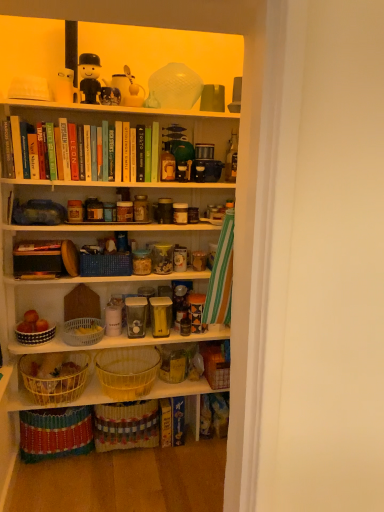
Question: From the image's perspective, is hardcover book at center, arranged as the 6th book when viewed from the top, located above or below white matte bookshelf at upper center?

Choices:
 (A) above
 (B) below

Answer: (B)

Question: In the image, is hardcover book at center, the second book in the right-to-left sequence, on the left side or the right side of white matte bookshelf at upper center?

Choices:
 (A) right
 (B) left

Answer: (A)

Question: Which object is positioned closest to the white matte bookshelf at upper center?

Choices:
 (A) green matte book at upper center, which appears as the third book when viewed from the left
 (B) translucent plastic bottle at center, the 2th bottle in the right-to-left sequence
 (C) hardcover book at center, marked as the first book in a bottom-to-top arrangement
 (D) matte glass bottle at center, arranged as the 1th bottle when viewed from the right
 (E) black and white ceramic bowl at lower left

Answer: (A)

Question: Which object is positioned farthest from the green matte book at upper center, the 2th book when ordered from top to bottom?

Choices:
 (A) matte white coffee cup at upper center
 (B) black plastic toy at upper center, the 3th toy viewed from the right
 (C) blue woven picnic basket at center
 (D) hardcover book at upper left, acting as the 3th book starting from the bottom
 (E) yellow wicker basket at lower left, the third box viewed from the right

Answer: (E)